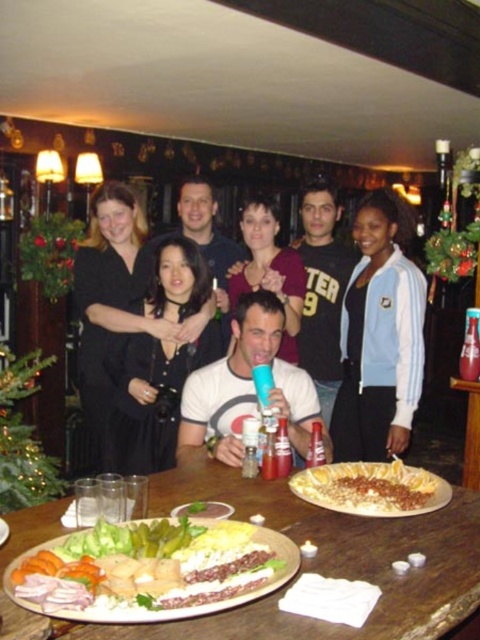
Question: Considering the real-world distances, which object is closest to the wooden table at center?

Choices:
 (A) blue and white jacket at center
 (B) golden crispy pastry at center

Answer: (B)

Question: Observing the image, what is the correct spatial positioning of blue and white jacket at center in reference to wooden plate with food at center?

Choices:
 (A) left
 (B) right

Answer: (B)

Question: Can you confirm if black satin dress at center is positioned to the right of white matte t-shirt at center?

Choices:
 (A) no
 (B) yes

Answer: (A)

Question: Among these points, which one is nearest to the camera?

Choices:
 (A) (268, 260)
 (B) (3, 540)
 (C) (374, 465)
 (D) (210, 545)

Answer: (D)

Question: Which point appears farthest from the camera in this image?

Choices:
 (A) (9, 532)
 (B) (171, 387)

Answer: (B)

Question: Is blue and white jacket at center to the right of black cotton shirt at center from the viewer's perspective?

Choices:
 (A) no
 (B) yes

Answer: (B)